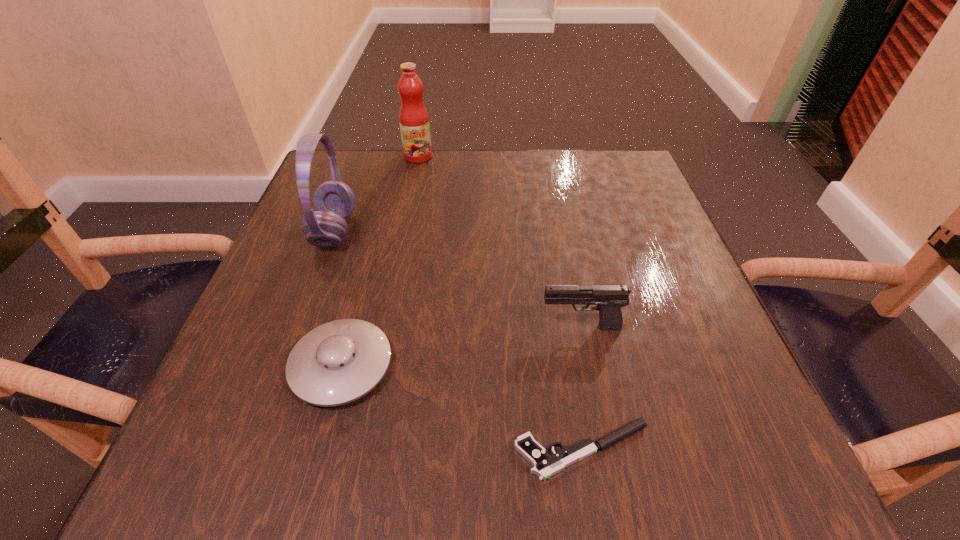
Find the location of a particular element. The height and width of the screenshot is (540, 960). free spot between the shorter pistol and the fourth nearest object is located at coordinates (459, 340).

Image resolution: width=960 pixels, height=540 pixels. What are the coordinates of `free space between the taller pistol and the headset` in the screenshot? It's located at (458, 279).

The height and width of the screenshot is (540, 960). Find the location of `empty location between the second shortest object and the headset`. empty location between the second shortest object and the headset is located at coordinates (338, 298).

The image size is (960, 540). What are the coordinates of `vacant space in between the headset and the taller pistol` in the screenshot? It's located at (458, 279).

Identify the location of free space between the farthest object and the fourth nearest object. The image size is (960, 540). (376, 193).

The height and width of the screenshot is (540, 960). I want to click on empty space between the farther pistol and the saucer, so click(x=461, y=347).

The width and height of the screenshot is (960, 540). I want to click on free space between the farthest object and the shorter pistol, so click(500, 303).

The height and width of the screenshot is (540, 960). I want to click on free point between the farther pistol and the second shortest object, so click(461, 347).

This screenshot has height=540, width=960. What are the coordinates of `free space between the farthest object and the taller pistol` in the screenshot? It's located at (499, 242).

The image size is (960, 540). In order to click on blank region between the farthest object and the farther pistol in this screenshot , I will do `click(499, 242)`.